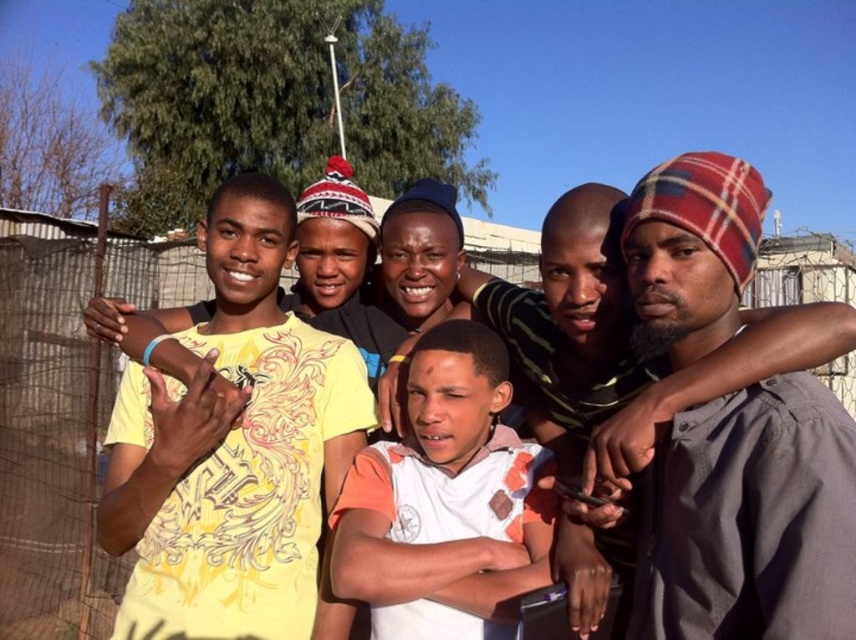
Question: Is yellow printed t-shirt at center behind metallic wire mesh at center?

Choices:
 (A) yes
 (B) no

Answer: (B)

Question: Which of the following is the farthest from the observer?

Choices:
 (A) (421, 452)
 (B) (818, 332)
 (C) (312, 477)
 (D) (835, 561)

Answer: (C)

Question: Does plaid fabric beanie at center appear under metallic wire mesh at center?

Choices:
 (A) yes
 (B) no

Answer: (A)

Question: Can you confirm if plaid fabric beanie at center is positioned below metallic wire mesh at center?

Choices:
 (A) no
 (B) yes

Answer: (B)

Question: Which point is farther to the camera?

Choices:
 (A) plaid fabric beanie at center
 (B) white cotton shirt at center
 (C) metallic wire mesh at center

Answer: (C)

Question: Which point is farther to the camera?

Choices:
 (A) (429, 346)
 (B) (688, 493)
 (C) (15, 602)
 (D) (245, 589)

Answer: (C)